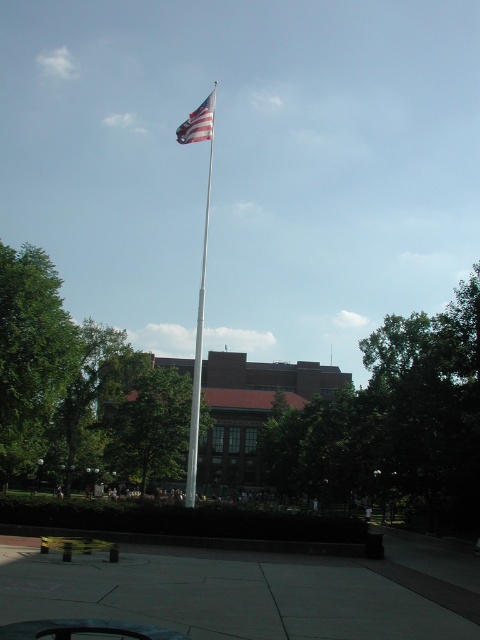
You are standing on the paved walkway in front of the white metallic flag pole at center. You want to place a small flower pot exactly halfway between yourself and the american flag at upper center. Where should you place the flower pot?

The white metallic flag pole at center is closer to the viewer than the american flag at upper center. To place the flower pot halfway between yourself and the american flag at upper center, you should position it halfway between the flag pole and the flag along the line connecting them.

You are a photographer trying to capture the American flag at upper center and the white metallic flag pole at center in a single shot. You notice that the flag pole is partially blocking the view of the building behind it. If you want to ensure both the flag and the flag pole are clearly visible, which object should you adjust your camera angle to focus on first?

The white metallic flag pole at center is thinner than the american flag at upper center. To ensure both are visible, focus on the thicker american flag at upper center first, as it occupies more space and might require more attention in the composition.